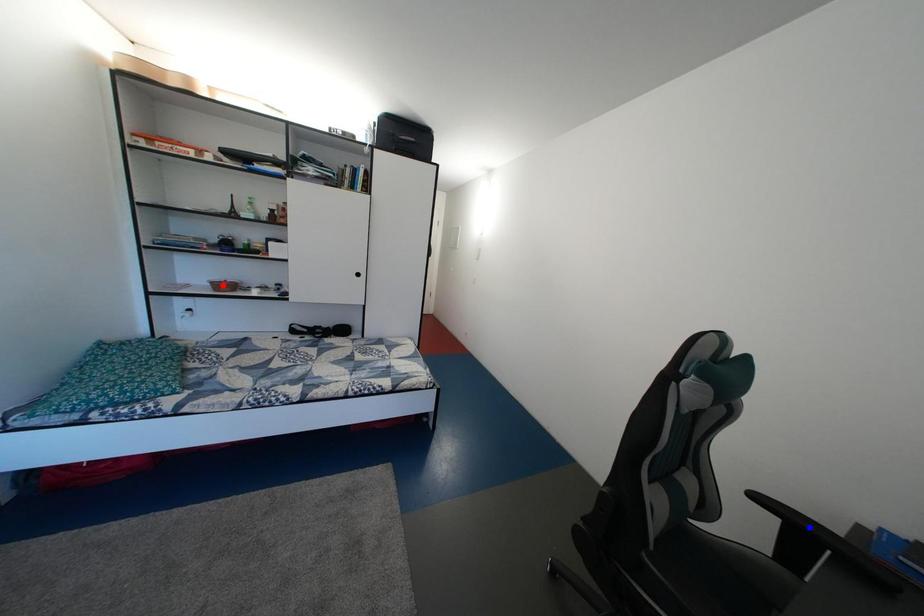
Question: In the image, two points are highlighted. Which point is nearer to the camera? Reply with the corresponding letter.

Choices:
 (A) blue point
 (B) red point

Answer: (A)